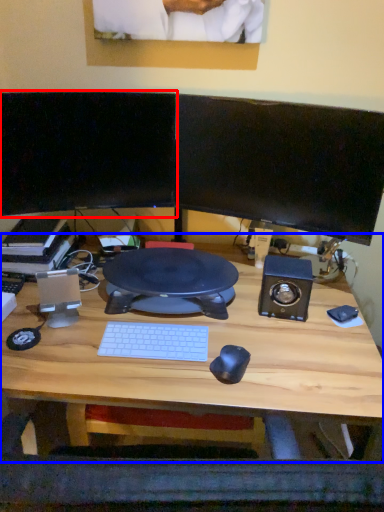
Question: Which object appears farthest to the camera in this image, computer monitor (highlighted by a red box) or desk (highlighted by a blue box)?

Choices:
 (A) computer monitor
 (B) desk

Answer: (A)